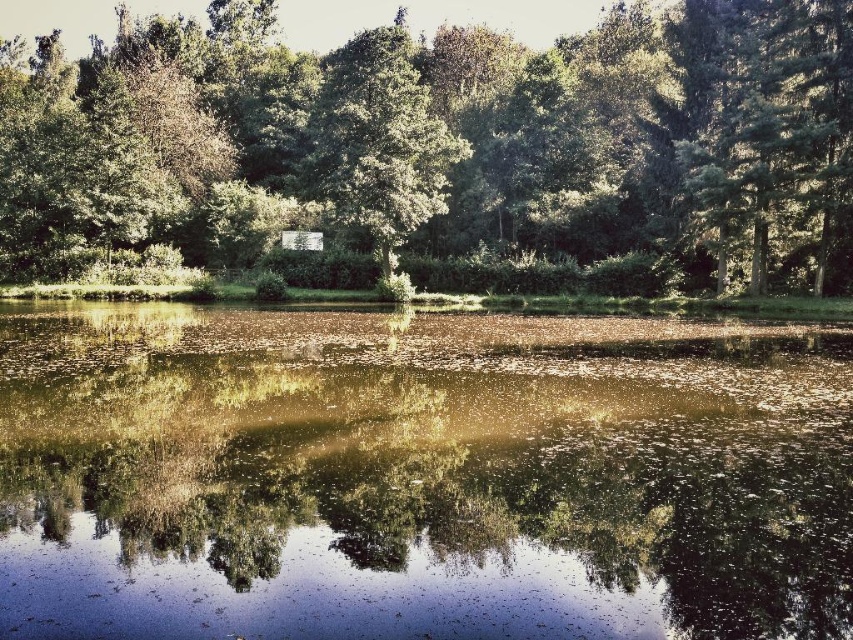
Question: Can you confirm if translucent reflective water at center is wider than green textured tree at upper right?

Choices:
 (A) yes
 (B) no

Answer: (A)

Question: Which point is closer to the camera taking this photo?

Choices:
 (A) (821, 77)
 (B) (706, 168)

Answer: (A)

Question: Which point is farther to the camera?

Choices:
 (A) green leafy tree at upper center
 (B) translucent reflective water at center

Answer: (A)

Question: Which point is farther to the camera?

Choices:
 (A) green leafy tree at center
 (B) green textured tree at upper right
 (C) green leafy tree at upper center

Answer: (A)

Question: Can you confirm if translucent reflective water at center is positioned below green leafy tree at center?

Choices:
 (A) yes
 (B) no

Answer: (A)

Question: Is green leafy tree at upper center below green leafy tree at center?

Choices:
 (A) no
 (B) yes

Answer: (A)